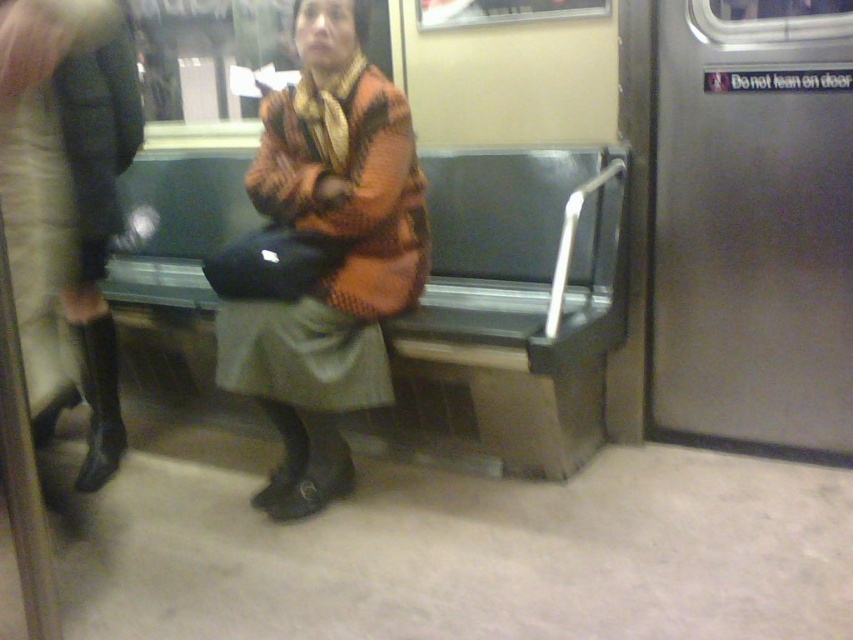
What are the coordinates of the green fabric bench at center?

The green fabric bench at center is located at point (509,314).

You are standing in the subway car and want to sit down. The green fabric bench at center is represented by point (509,314). Is there enough space on the green fabric bench at center for you to sit?

The green fabric bench at center is represented by point (509,314). The bench has a metallic finish with a dark green cushion and is occupied by a woman wearing a patterned orange and black jacket. Since the woman is seated, there might be some space remaining, but the exact availability isn